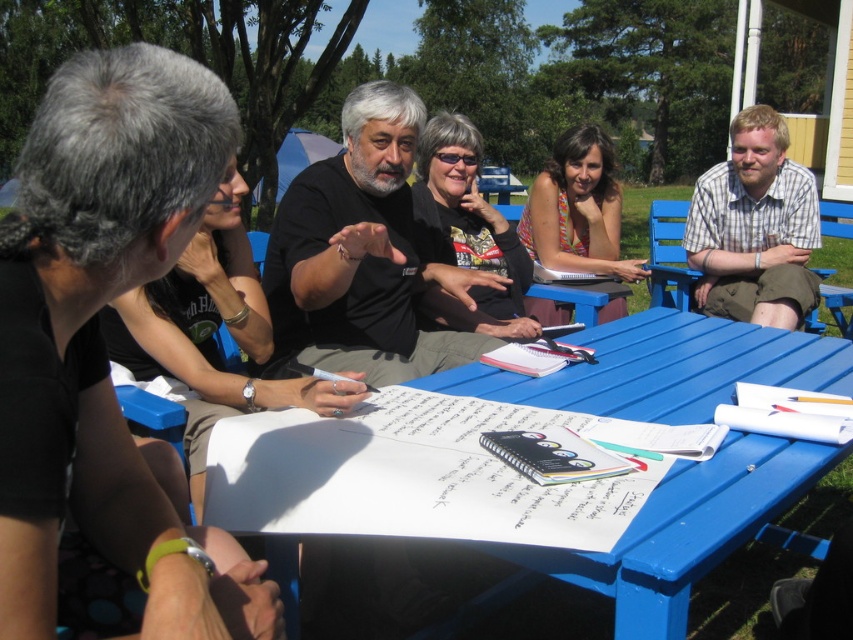
Question: Which of these objects is positioned farthest from the plaid shirt at upper right?

Choices:
 (A) blue plastic table at center
 (B) black matte shirt at center

Answer: (A)

Question: Can you confirm if black matte shirt at center is positioned above blue wood park bench at right?

Choices:
 (A) no
 (B) yes

Answer: (A)

Question: Which point is closer to the camera?

Choices:
 (A) plaid shirt at upper right
 (B) blue wood park bench at right

Answer: (A)

Question: Is black matte shirt at center bigger than plaid shirt at upper right?

Choices:
 (A) no
 (B) yes

Answer: (A)

Question: Can you confirm if black matte shirt at center is wider than plaid shirt at upper right?

Choices:
 (A) no
 (B) yes

Answer: (B)

Question: Among these objects, which one is nearest to the camera?

Choices:
 (A) black matte shirt at center
 (B) plaid shirt at upper right
 (C) blue plastic table at center

Answer: (C)